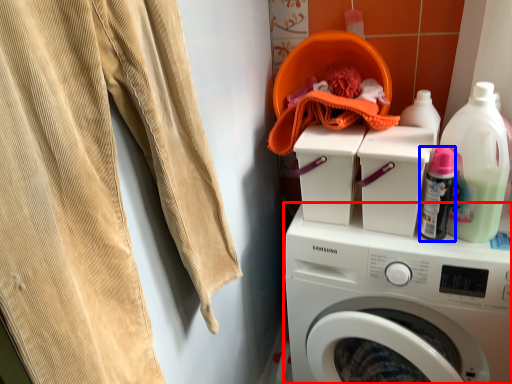
Question: Which object is closer to the camera taking this photo, washing machine (highlighted by a red box) or bottle (highlighted by a blue box)?

Choices:
 (A) washing machine
 (B) bottle

Answer: (A)